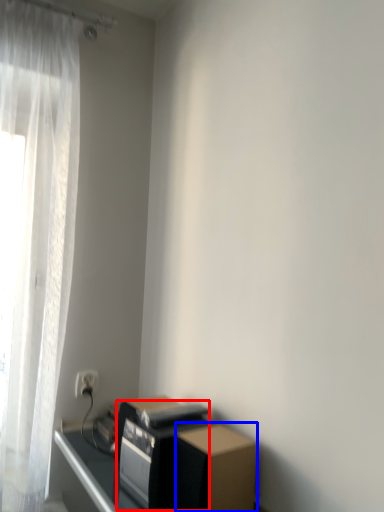
Question: Which point is further to the camera, appliance (highlighted by a red box) or cardboard box (highlighted by a blue box)?

Choices:
 (A) appliance
 (B) cardboard box

Answer: (A)